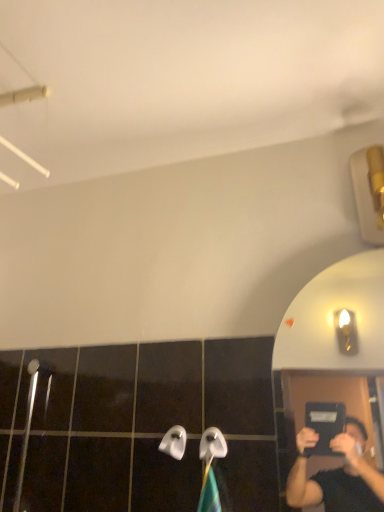
Question: Based on their sizes in the image, would you say white plastic towel bar at center, which appears as the 2th towel bar when viewed from the left, is bigger or smaller than white plastic towel bar at center, the second towel bar viewed from the right?

Choices:
 (A) small
 (B) big

Answer: (B)

Question: In terms of width, does white plastic towel bar at center, which appears as the 2th towel bar when viewed from the left, look wider or thinner when compared to white plastic towel bar at center, acting as the 1th towel bar starting from the left?

Choices:
 (A) thin
 (B) wide

Answer: (B)

Question: Do you think white plastic towel bar at center, which appears as the 2th towel bar when viewed from the left, is within white plastic towel bar at center, acting as the 1th towel bar starting from the left, or outside of it?

Choices:
 (A) inside
 (B) outside

Answer: (B)

Question: Does point (165, 433) appear closer or farther from the camera than point (223, 454)?

Choices:
 (A) farther
 (B) closer

Answer: (A)

Question: From the image's perspective, is white plastic towel bar at center, acting as the 1th towel bar starting from the left, positioned above or below white plastic towel bar at center, which appears as the 1th towel bar when viewed from the right?

Choices:
 (A) above
 (B) below

Answer: (B)

Question: In terms of height, does white plastic towel bar at center, acting as the 1th towel bar starting from the left, look taller or shorter compared to white plastic towel bar at center, which appears as the 1th towel bar when viewed from the right?

Choices:
 (A) short
 (B) tall

Answer: (A)

Question: Based on their positions, is white plastic towel bar at center, acting as the 1th towel bar starting from the left, located to the left or right of white plastic towel bar at center, which appears as the 2th towel bar when viewed from the left?

Choices:
 (A) right
 (B) left

Answer: (B)